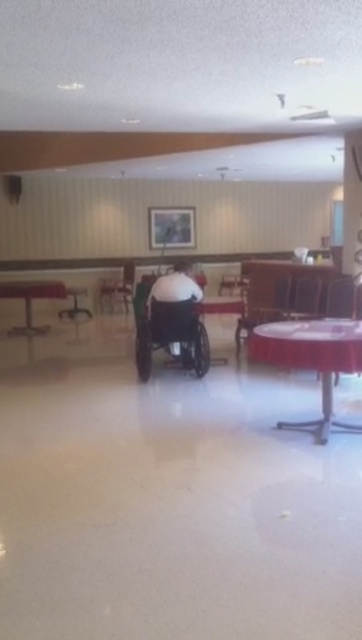
Question: Does red plastic table at center have a lesser width compared to wooden chair at center?

Choices:
 (A) no
 (B) yes

Answer: (A)

Question: Which is nearer to the red plastic table at center?

Choices:
 (A) metallic silver table at left
 (B) green plastic wheelchair at center
 (C) metallic silver chair at right

Answer: (B)

Question: Is green plastic wheelchair at center behind wooden chair at center?

Choices:
 (A) yes
 (B) no

Answer: (B)

Question: Among these objects, which one is nearest to the camera?

Choices:
 (A) metallic silver chair at right
 (B) wooden chair at center
 (C) metallic silver table at left

Answer: (A)

Question: Is red plastic table at center positioned before metallic silver chair at right?

Choices:
 (A) no
 (B) yes

Answer: (B)

Question: Which point is farther to the camera?

Choices:
 (A) wooden chair at center
 (B) red plastic table at center

Answer: (A)